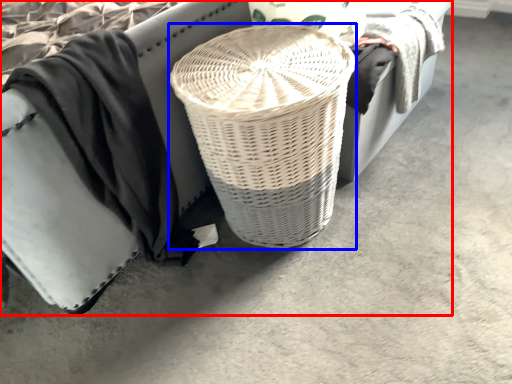
Question: Which of the following is the farthest to the observer, furniture (highlighted by a red box) or basket (highlighted by a blue box)?

Choices:
 (A) furniture
 (B) basket

Answer: (B)